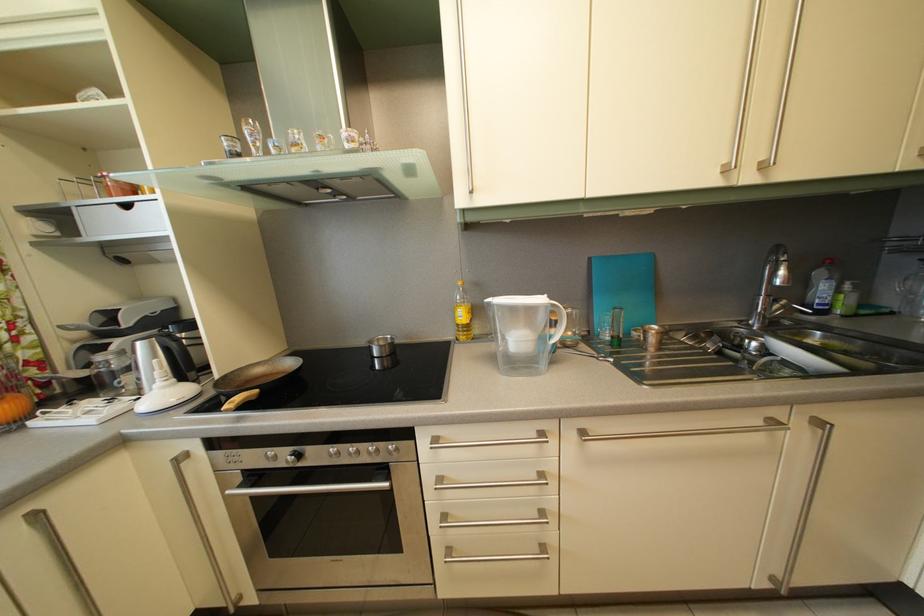
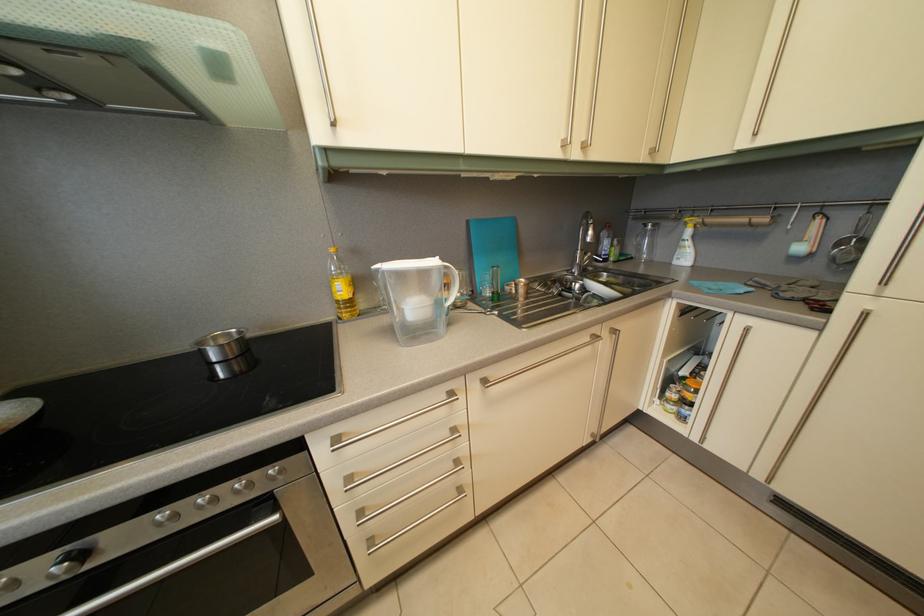
Find the pixel in the second image that matches (x=386, y=347) in the first image.

(224, 346)